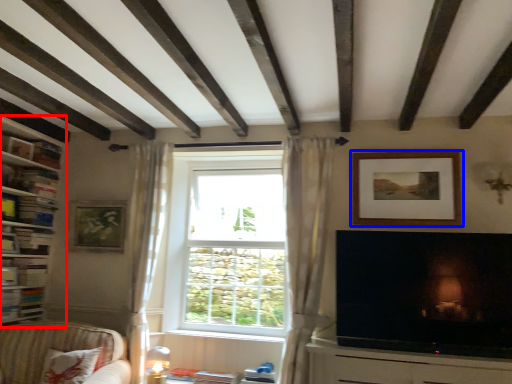
Question: Which object appears closest to the camera in this image, shelf (highlighted by a red box) or picture frame (highlighted by a blue box)?

Choices:
 (A) shelf
 (B) picture frame

Answer: (A)